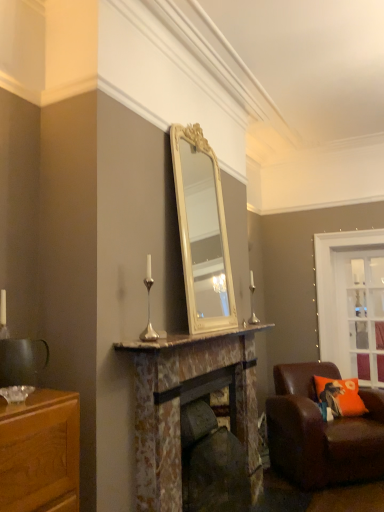
Locate an element on the screen. The height and width of the screenshot is (512, 384). marble mantel at center is located at coordinates (188, 338).

What do you see at coordinates (340, 396) in the screenshot?
I see `orange fabric pillow at lower right` at bounding box center [340, 396].

In the scene shown: Measure the distance between orange fabric pillow at lower right and camera.

3.52 meters.

This screenshot has height=512, width=384. Identify the location of matte black mug at left. (21, 361).

Can you confirm if silver metallic candle holder at right, positioned as the 1th candle holder in right-to-left order, is wider than marble fireplace at center, marked as the first fireplace in a front-to-back arrangement?

No, silver metallic candle holder at right, positioned as the 1th candle holder in right-to-left order, is not wider than marble fireplace at center, marked as the first fireplace in a front-to-back arrangement.

Does silver metallic candle holder at right, acting as the second candle holder starting from the left, have a greater height compared to marble fireplace at center, marked as the first fireplace in a front-to-back arrangement?

No, silver metallic candle holder at right, acting as the second candle holder starting from the left, is not taller than marble fireplace at center, marked as the first fireplace in a front-to-back arrangement.

Which object is closer to the camera, silver metallic candle holder at right, acting as the second candle holder starting from the left, or marble fireplace at center, marked as the first fireplace in a front-to-back arrangement?

marble fireplace at center, marked as the first fireplace in a front-to-back arrangement, is in front.

Considering the relative sizes of rustic stone fireplace at center, the second fireplace in the front-to-back sequence, and marble fireplace at center, the second fireplace from the back, in the image provided, is rustic stone fireplace at center, the second fireplace in the front-to-back sequence, bigger than marble fireplace at center, the second fireplace from the back,?

Actually, rustic stone fireplace at center, the second fireplace in the front-to-back sequence, might be smaller than marble fireplace at center, the second fireplace from the back.

From the image's perspective, between rustic stone fireplace at center, the 1th fireplace in the back-to-front sequence, and marble fireplace at center, the second fireplace from the back, who is located below?

rustic stone fireplace at center, the 1th fireplace in the back-to-front sequence.

This screenshot has height=512, width=384. What are the coordinates of `fireplace that appears below the marble fireplace at center, marked as the first fireplace in a front-to-back arrangement (from a real-world perspective)` in the screenshot? It's located at (211, 456).

In the scene shown: Is rustic stone fireplace at center, the 1th fireplace in the back-to-front sequence, outside of marble fireplace at center, marked as the first fireplace in a front-to-back arrangement?

No, rustic stone fireplace at center, the 1th fireplace in the back-to-front sequence, is inside marble fireplace at center, marked as the first fireplace in a front-to-back arrangement,'s boundary.

Which object is wider, marble fireplace at center, the second fireplace from the back, or matte black mug at left?

Wider between the two is marble fireplace at center, the second fireplace from the back.

Locate an element on the screen. The height and width of the screenshot is (512, 384). the 1st fireplace below the matte black mug at left (from the image's perspective) is located at coordinates (188, 402).

Based on the photo, does marble fireplace at center, marked as the first fireplace in a front-to-back arrangement, come in front of matte black mug at left?

No, marble fireplace at center, marked as the first fireplace in a front-to-back arrangement, is behind matte black mug at left.

Considering the relative positions of marble fireplace at center, the second fireplace from the back, and matte black mug at left in the image provided, is marble fireplace at center, the second fireplace from the back, to the right of matte black mug at left from the viewer's perspective?

Indeed, marble fireplace at center, the second fireplace from the back, is positioned on the right side of matte black mug at left.

From a real-world perspective, who is located higher, rustic stone fireplace at center, the 1th fireplace in the back-to-front sequence, or matte black mug at left?

matte black mug at left.

Is rustic stone fireplace at center, the second fireplace in the front-to-back sequence, next to matte black mug at left?

No, rustic stone fireplace at center, the second fireplace in the front-to-back sequence, is not next to matte black mug at left.

Which is closer, (219, 451) or (44, 362)?

The point (44, 362) is more forward.

Is the position of rustic stone fireplace at center, the 1th fireplace in the back-to-front sequence, more distant than that of matte black mug at left?

Yes, it is behind matte black mug at left.

Is the position of clear glass door at upper right more distant than that of matte black mug at left?

That is True.

Which is behind, point (378, 270) or point (13, 340)?

The point (378, 270) is more distant.

Does clear glass door at upper right appear on the right side of matte black mug at left?

Indeed, clear glass door at upper right is positioned on the right side of matte black mug at left.

Does silver metallic candle holder at center, the first candle holder viewed from the front, appear on the right side of rustic stone fireplace at center, the 1th fireplace in the back-to-front sequence?

In fact, silver metallic candle holder at center, the first candle holder viewed from the front, is to the left of rustic stone fireplace at center, the 1th fireplace in the back-to-front sequence.

From the image's perspective, count 2nd fireplaces downward from the silver metallic candle holder at center, which ranks as the 2th candle holder in right-to-left order, and point to it. Please provide its 2D coordinates.

[(211, 456)]

Is silver metallic candle holder at center, the first candle holder viewed from the front, next to rustic stone fireplace at center, the second fireplace in the front-to-back sequence, and touching it?

No, silver metallic candle holder at center, the first candle holder viewed from the front, is not with rustic stone fireplace at center, the second fireplace in the front-to-back sequence.

Looking at this image, from a real-world perspective, which object stands above the other?

matte black mug at left is physically above.

Is brown leather chair at lower right next to matte black mug at left and touching it?

No, brown leather chair at lower right is not in contact with matte black mug at left.

From the picture: Considering the relative positions of brown leather chair at lower right and matte black mug at left in the image provided, is brown leather chair at lower right behind matte black mug at left?

Yes, it is behind matte black mug at left.

From the image's perspective, starting from the marble fireplace at center, marked as the first fireplace in a front-to-back arrangement, which candle holder is the 1st one above? Please provide its 2D coordinates.

[(252, 301)]

Locate an element on the screen. This screenshot has width=384, height=512. fireplace lying on the left of rustic stone fireplace at center, the 1th fireplace in the back-to-front sequence is located at coordinates tap(188, 402).

When comparing their distances from silver metallic candle holder at right, marked as the first candle holder in a back-to-front arrangement, does marble mantel at center or orange fabric pillow at lower right seem closer?

orange fabric pillow at lower right.

From the image, which object appears to be farther from clear glass door at upper right, rustic stone fireplace at center, the 1th fireplace in the back-to-front sequence, or brown leather chair at lower right?

rustic stone fireplace at center, the 1th fireplace in the back-to-front sequence, lies further to clear glass door at upper right than the other object.

Based on their spatial positions, is brown leather chair at lower right or silver metallic candle holder at right, acting as the second candle holder starting from the left, further from marble fireplace at center, the second fireplace from the back?

The object further to marble fireplace at center, the second fireplace from the back, is silver metallic candle holder at right, acting as the second candle holder starting from the left.

From the image, which object appears to be farther from silver metallic candle holder at right, marked as the first candle holder in a back-to-front arrangement, rustic stone fireplace at center, the 1th fireplace in the back-to-front sequence, or marble mantel at center?

rustic stone fireplace at center, the 1th fireplace in the back-to-front sequence.

Which object lies further to the anchor point orange fabric pillow at lower right, rustic stone fireplace at center, the 1th fireplace in the back-to-front sequence, or brown leather chair at lower right?

Based on the image, rustic stone fireplace at center, the 1th fireplace in the back-to-front sequence, appears to be further to orange fabric pillow at lower right.

Based on their spatial positions, is rustic stone fireplace at center, the 1th fireplace in the back-to-front sequence, or silver metallic candle holder at center, which ranks as the 2th candle holder in right-to-left order, further from matte black mug at left?

rustic stone fireplace at center, the 1th fireplace in the back-to-front sequence, lies further to matte black mug at left than the other object.

From the image, which object appears to be nearer to rustic stone fireplace at center, the 1th fireplace in the back-to-front sequence, matte black mug at left or brown leather chair at lower right?

brown leather chair at lower right.

Considering their positions, is orange fabric pillow at lower right positioned further to silver metallic candle holder at center, the first candle holder viewed from the front, than rustic stone fireplace at center, the 1th fireplace in the back-to-front sequence?

orange fabric pillow at lower right lies further to silver metallic candle holder at center, the first candle holder viewed from the front, than the other object.

In order to click on candle holder between matte black mug at left and marble mantel at center in this screenshot , I will do `click(149, 306)`.

Find the location of a particular element. fireplace positioned between silver metallic candle holder at center, the first candle holder viewed from the front, and silver metallic candle holder at right, which is counted as the second candle holder, starting from the front, from near to far is located at coordinates (211, 456).

Image resolution: width=384 pixels, height=512 pixels. I want to click on fireplace positioned between silver metallic candle holder at center, which ranks as the 2th candle holder in right-to-left order, and clear glass door at upper right from near to far, so click(211, 456).

This screenshot has height=512, width=384. In order to click on fireplace between marble mantel at center and rustic stone fireplace at center, the second fireplace in the front-to-back sequence, in the up-down direction in this screenshot , I will do `click(188, 402)`.